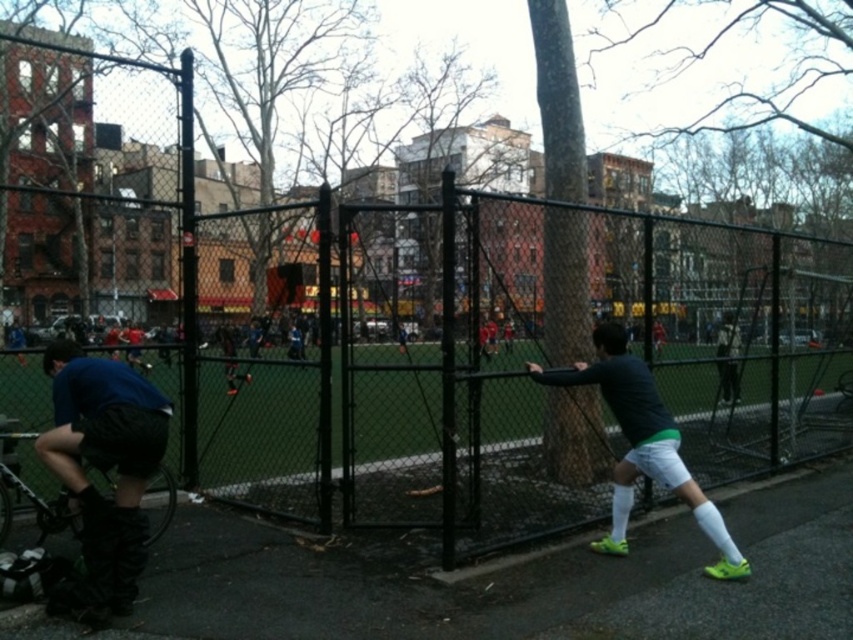
Does matte blue shirt at lower left have a lesser width compared to dark gray matte shirt at right?

Correct, matte blue shirt at lower left's width is less than dark gray matte shirt at right's.

Does matte blue shirt at lower left appear over dark gray matte shirt at right?

Indeed, matte blue shirt at lower left is positioned over dark gray matte shirt at right.

The image size is (853, 640). What are the coordinates of `matte blue shirt at lower left` in the screenshot? It's located at (103, 468).